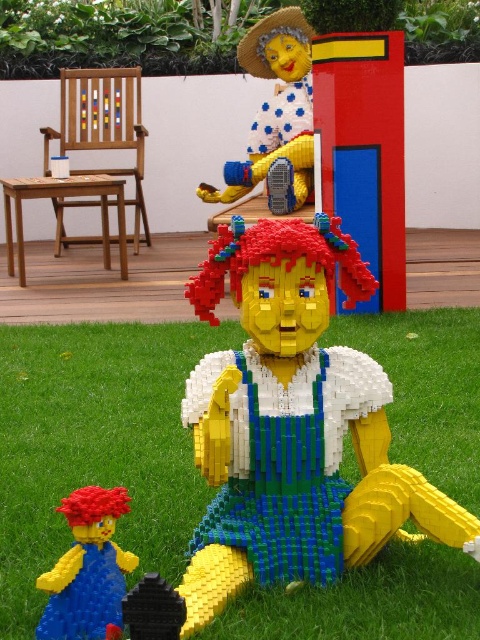
Please provide the exact 2D coordinates of the matte yellow plastic figure at upper center in the image. The coordinates should be in the format of a point with two decimal places, such as point X, Y.

The exact 2D coordinates of the matte yellow plastic figure at upper center are point (x=276, y=115).

What is located at the coordinates point (96, 444) in the image?

The green grass at lower center is located at point (96, 444).